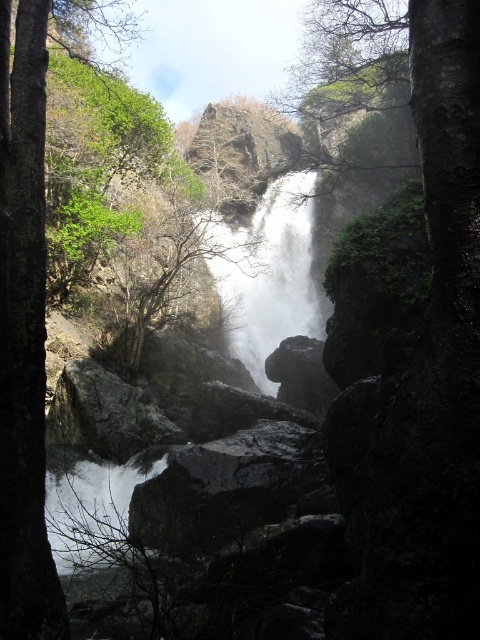
Is white smooth waterfall at center taller than rough textured rock at center?

Yes.

Looking at this image, which is more to the right, white smooth waterfall at center or rough textured rock at center?

white smooth waterfall at center is more to the right.

You are a GUI agent. You are given a task and a screenshot of the screen. Output one action in this format:
    pyautogui.click(x=<x>, y=<y>)
    Task: Click on the white smooth waterfall at center
    The image size is (480, 640).
    Given the screenshot: What is the action you would take?
    pyautogui.click(x=268, y=275)

Between point (163, 529) and point (261, 324), which one is positioned in front?

Point (163, 529) is in front.

I want to click on dark gray rock at center, so click(227, 488).

The width and height of the screenshot is (480, 640). In order to click on dark gray rock at center in this screenshot , I will do `click(227, 488)`.

Is dark gray rock at center to the right of rough textured rock at center from the viewer's perspective?

Correct, you'll find dark gray rock at center to the right of rough textured rock at center.

Can you confirm if dark gray rock at center is bigger than rough textured rock at center?

Actually, dark gray rock at center might be smaller than rough textured rock at center.

Is point (286, 456) farther from camera compared to point (64, 381)?

No, (286, 456) is in front of (64, 381).

Where is `dark gray rock at center`? dark gray rock at center is located at coordinates (227, 488).